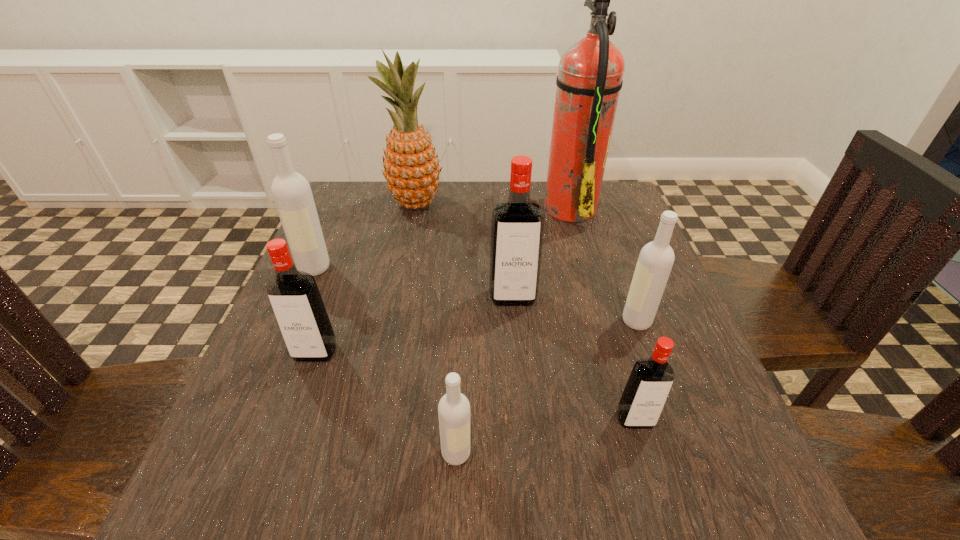
What are the coordinates of `the third closest white vodka relative to the second red vodka from left to right` in the screenshot? It's located at (291, 191).

The height and width of the screenshot is (540, 960). What are the coordinates of `white vodka that is the second nearest to the fourth nearest object` in the screenshot? It's located at pos(291,191).

You are a GUI agent. You are given a task and a screenshot of the screen. Output one action in this format:
    pyautogui.click(x=<x>, y=<y>)
    Task: Click on the red vodka that is the second closest to the second smallest red vodka
    
    Given the screenshot: What is the action you would take?
    pyautogui.click(x=649, y=384)

Locate an element on the screen. The height and width of the screenshot is (540, 960). red vodka that is the closest to the pineapple is located at coordinates (517, 223).

This screenshot has height=540, width=960. I want to click on vacant region that satisfies the following two spatial constraints: 1. on the front and back of the second biggest white vodka; 2. on the right side of the biggest red vodka, so click(515, 321).

Locate an element on the screen. vacant point that satisfies the following two spatial constraints: 1. on the front side of the seventh shortest object; 2. on the right side of the fifth object from right to left is located at coordinates (364, 453).

What are the coordinates of `vacant space that satisfies the following two spatial constraints: 1. at the nozzle of the tallest object; 2. on the back side of the second biggest white vodka` in the screenshot? It's located at (602, 321).

Identify the location of vacant region that satisfies the following two spatial constraints: 1. at the nozzle of the tallest object; 2. on the back side of the fifth farthest object. Image resolution: width=960 pixels, height=540 pixels. (602, 321).

Image resolution: width=960 pixels, height=540 pixels. Identify the location of free location that satisfies the following two spatial constraints: 1. on the back side of the nearest object; 2. on the right side of the second biggest white vodka. (462, 321).